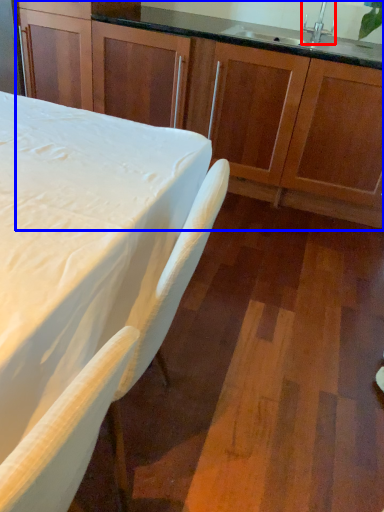
Question: Which object appears farthest to the camera in this image, faucet (highlighted by a red box) or cabinetry (highlighted by a blue box)?

Choices:
 (A) faucet
 (B) cabinetry

Answer: (A)